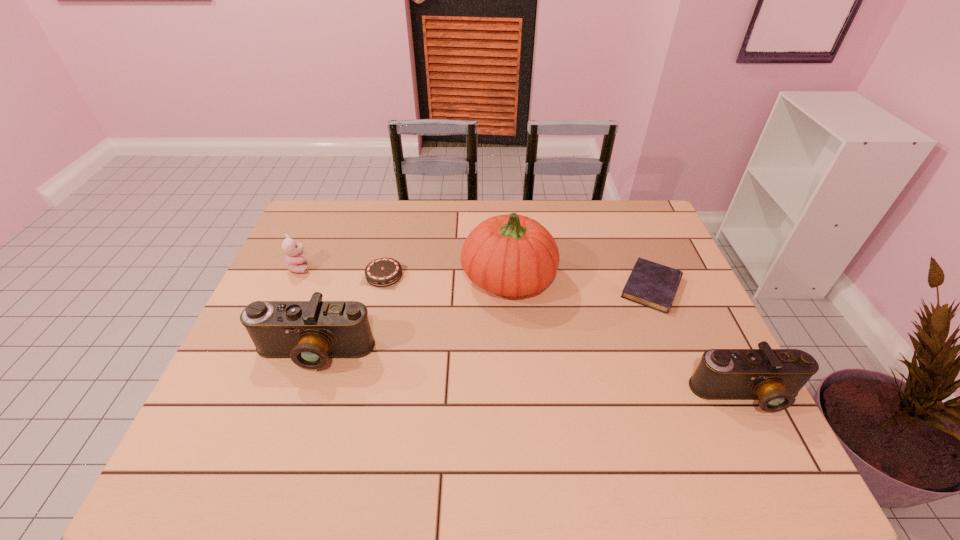
Where is `vacant area situated on the left of the tallest object`? The image size is (960, 540). vacant area situated on the left of the tallest object is located at coordinates (338, 279).

Locate an element on the screen. Image resolution: width=960 pixels, height=540 pixels. free space located on the left of the chocolate cake is located at coordinates (325, 275).

Identify the location of vacant space situated at the face of the teddy bear. (409, 267).

Where is `object situated at the near edge`? The height and width of the screenshot is (540, 960). object situated at the near edge is located at coordinates (774, 377).

This screenshot has width=960, height=540. Find the location of `camera at the left edge`. camera at the left edge is located at coordinates (310, 332).

Find the location of `teddy bear that is at the left edge`. teddy bear that is at the left edge is located at coordinates point(295,262).

The height and width of the screenshot is (540, 960). Identify the location of camera present at the right edge. (774, 377).

This screenshot has height=540, width=960. What are the coordinates of `diary that is positioned at the right edge` in the screenshot? It's located at (650, 284).

Where is `object at the near right corner`? This screenshot has height=540, width=960. object at the near right corner is located at coordinates (774, 377).

Identify the location of vacant region at the far edge of the desktop. The height and width of the screenshot is (540, 960). (456, 205).